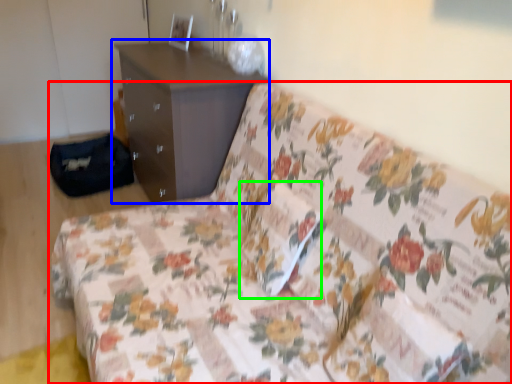
Question: Estimate the real-world distances between objects in this image. Which object is closer to studio couch (highlighted by a red box), chest of drawers (highlighted by a blue box) or pillow (highlighted by a green box)?

Choices:
 (A) chest of drawers
 (B) pillow

Answer: (B)